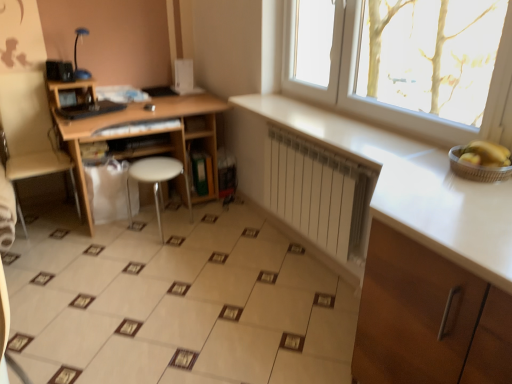
This screenshot has height=384, width=512. I want to click on free space below white matte radiator at center (from a real-world perspective), so click(x=307, y=258).